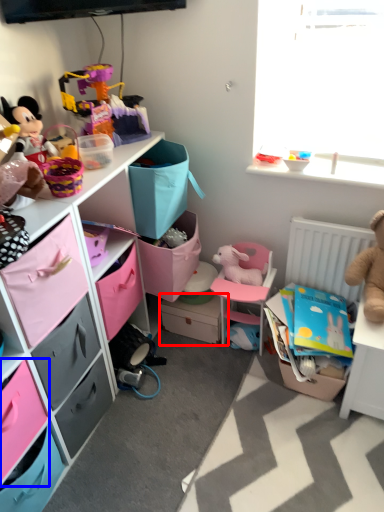
Question: Among these objects, which one is nearest to the camera, storage box (highlighted by a red box) or drawer (highlighted by a blue box)?

Choices:
 (A) storage box
 (B) drawer

Answer: (B)